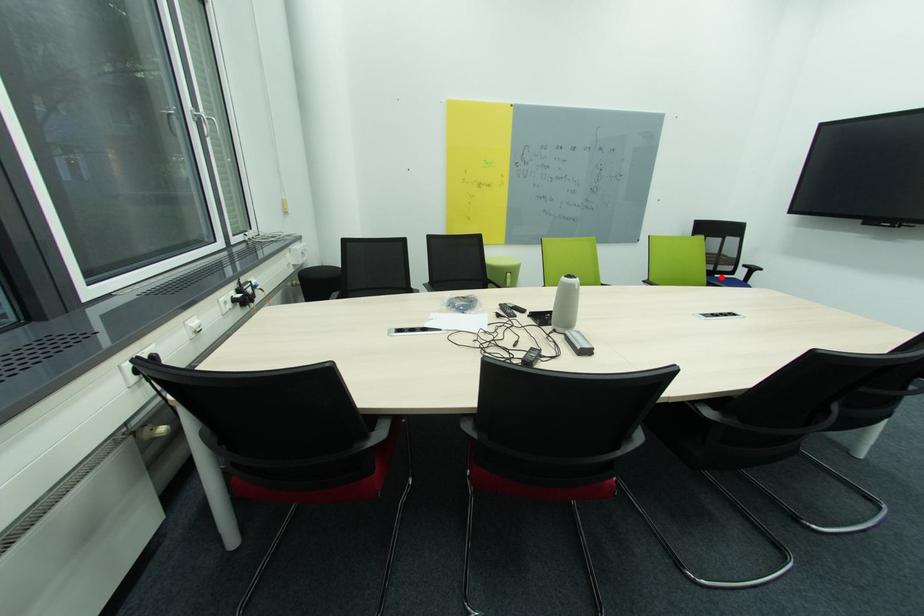
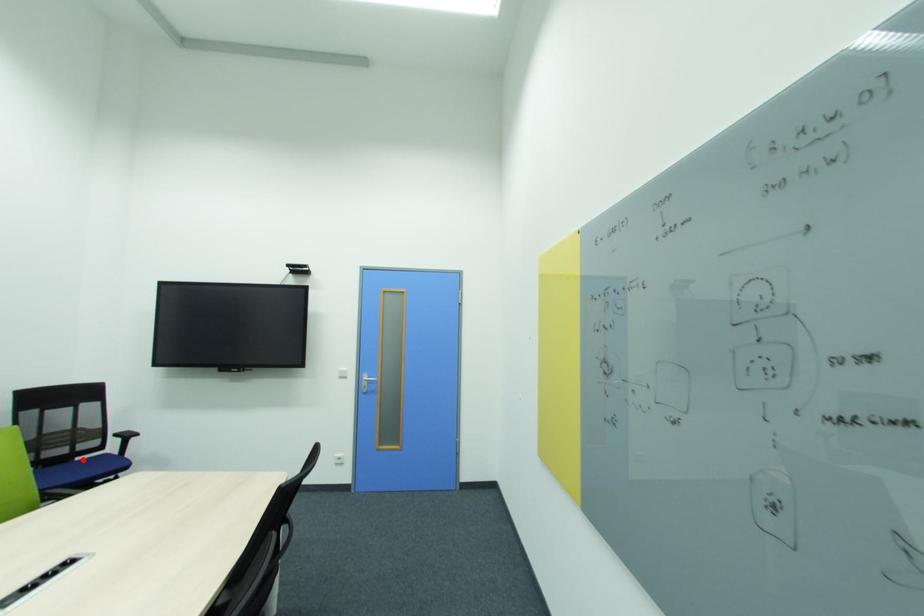
I am providing you with two images of the same scene from different viewpoints. A red point is marked on the first image and another point is marked on the second image. Is the marked point in image1 the same physical position as the marked point in image2?

Yes